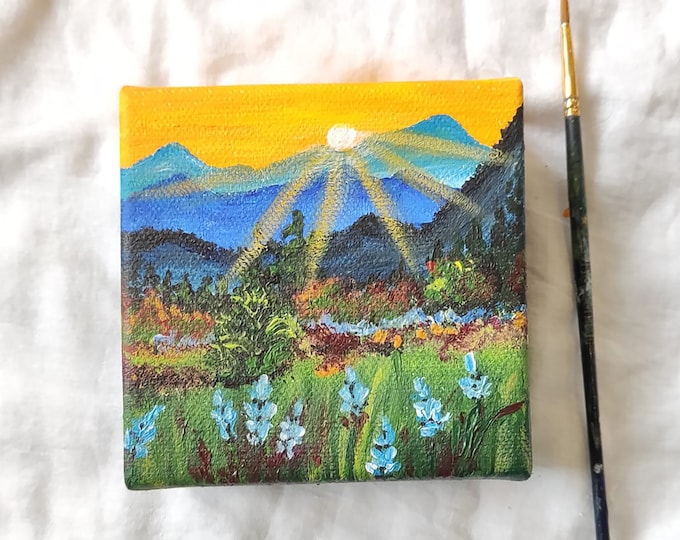
This screenshot has width=680, height=540. Find the location of `white tablecloth`. white tablecloth is located at coordinates (90, 239).